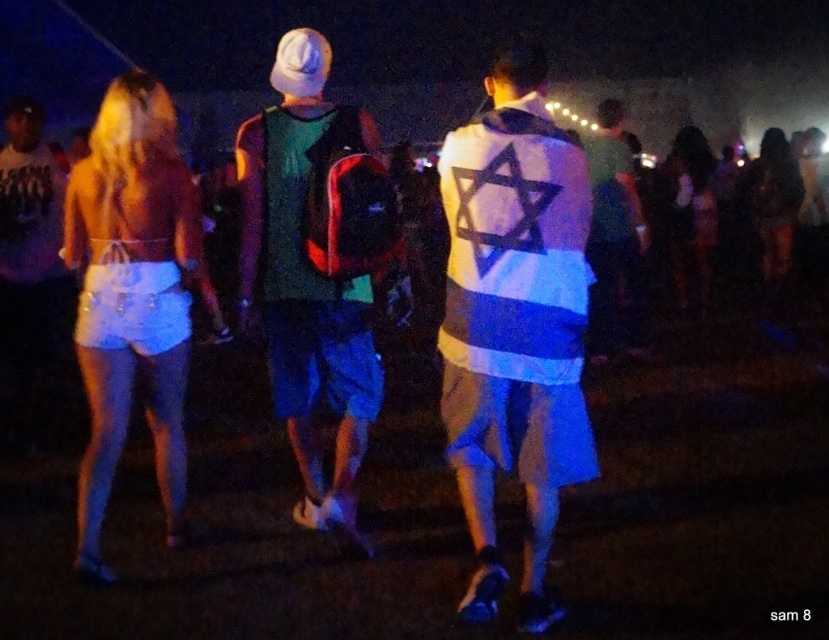
Does white fabric vest at center have a greater width compared to white satin shorts at left?

No.

Measure the distance between white fabric vest at center and white satin shorts at left.

4.86 feet

Locate an element on the screen. This screenshot has height=640, width=829. white fabric vest at center is located at coordinates (514, 323).

I want to click on white fabric vest at center, so click(514, 323).

Does point (502, 252) come farther from viewer compared to point (259, 252)?

No, (502, 252) is in front of (259, 252).

Does white fabric vest at center have a lesser width compared to green fabric shirt at center?

Yes.

Which is behind, point (503, 234) or point (258, 294)?

The point (258, 294) is behind.

You are a GUI agent. You are given a task and a screenshot of the screen. Output one action in this format:
    pyautogui.click(x=<x>, y=<y>)
    Task: Click on the white fabric vest at center
    The height and width of the screenshot is (640, 829).
    Given the screenshot: What is the action you would take?
    pos(514,323)

Is point (299, 273) farther from camera compared to point (90, 209)?

No, it is not.

Can you confirm if green fabric shirt at center is positioned below white satin shorts at left?

No, green fabric shirt at center is not below white satin shorts at left.

Where is `green fabric shirt at center`? green fabric shirt at center is located at coordinates (313, 272).